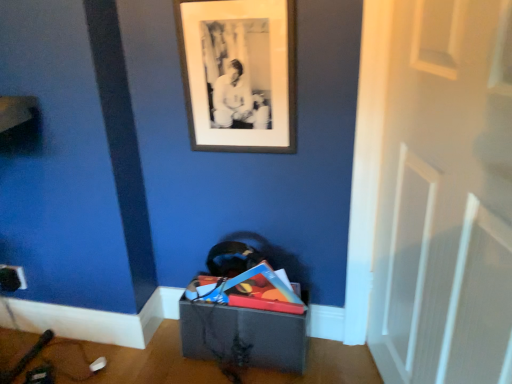
Question: Looking at the image, does black matte picture frame at upper center seem bigger or smaller compared to matte gray storage box at lower center?

Choices:
 (A) big
 (B) small

Answer: (B)

Question: Based on their positions, is black matte picture frame at upper center located to the left or right of matte gray storage box at lower center?

Choices:
 (A) left
 (B) right

Answer: (A)

Question: Which object is the closest to the white matte door at center?

Choices:
 (A) black matte picture frame at upper center
 (B) matte gray storage box at lower center

Answer: (A)

Question: Which object is the farthest from the white matte door at center?

Choices:
 (A) black matte picture frame at upper center
 (B) matte gray storage box at lower center

Answer: (B)